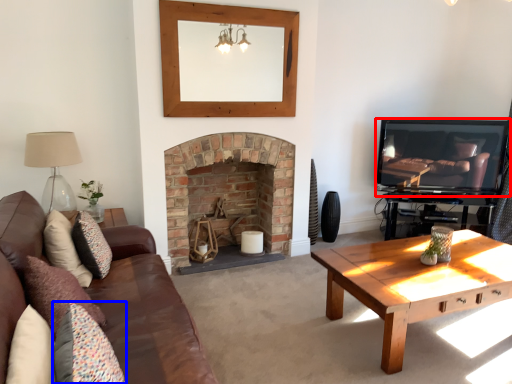
Question: Among these objects, which one is nearest to the camera, television (highlighted by a red box) or pillow (highlighted by a blue box)?

Choices:
 (A) television
 (B) pillow

Answer: (B)